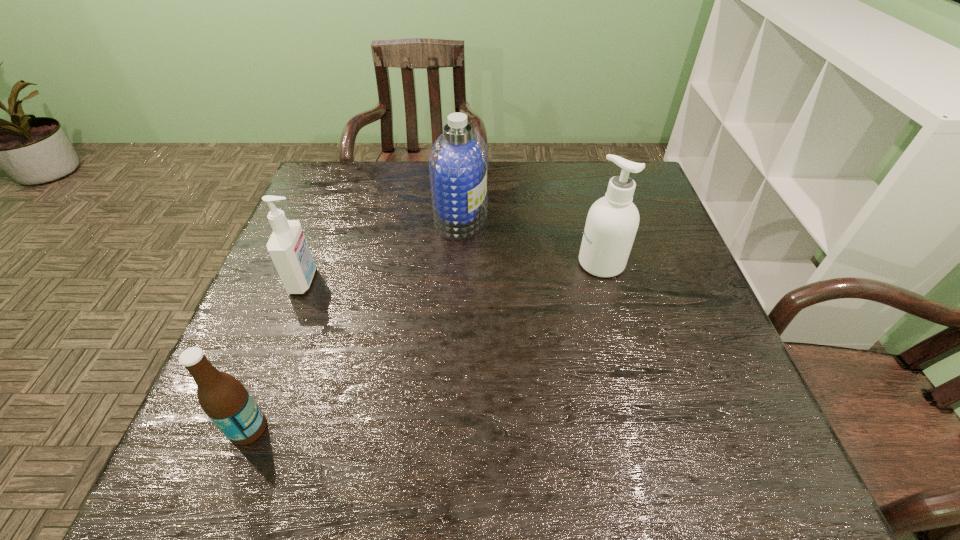
Where is `the farthest object`? This screenshot has width=960, height=540. the farthest object is located at coordinates (458, 163).

At what (x,y) coordinates should I click in order to perform the action: click on the farthest cleansing agent. Please return your answer as a coordinate pair (x, y). Looking at the image, I should click on (458, 163).

The width and height of the screenshot is (960, 540). Identify the location of the rightmost object. (612, 222).

Image resolution: width=960 pixels, height=540 pixels. What are the coordinates of `the shortest cleansing agent` in the screenshot? It's located at (287, 246).

Locate an element on the screen. The image size is (960, 540). beer bottle is located at coordinates (224, 399).

The height and width of the screenshot is (540, 960). Identify the location of vacant space located on the front of the second object from right to left. (455, 340).

Find the location of a particular element. This screenshot has width=960, height=540. vacant space located 0.350m on the front label of the rightmost cleansing agent is located at coordinates (440, 263).

Where is `free region located 0.270m on the front label of the rightmost cleansing agent`? free region located 0.270m on the front label of the rightmost cleansing agent is located at coordinates (471, 263).

I want to click on blank space located on the front label of the rightmost cleansing agent, so click(550, 263).

Find the location of `vacant space situated on the front label of the leftmost cleansing agent`. vacant space situated on the front label of the leftmost cleansing agent is located at coordinates (444, 280).